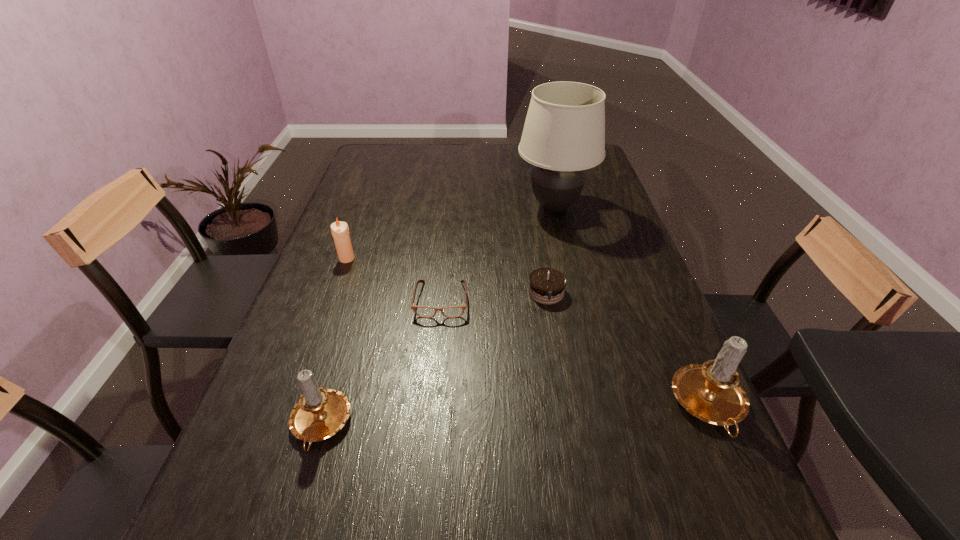
You are a GUI agent. You are given a task and a screenshot of the screen. Output one action in this format:
    pyautogui.click(x=<x>, y=<y>)
    Task: Click on the vacant space located on the front of the chocolate cake
    
    Given the screenshot: What is the action you would take?
    pyautogui.click(x=571, y=444)

Where is `free point located on the back of the fifth nearest object`? free point located on the back of the fifth nearest object is located at coordinates point(367,205).

At what (x,y) coordinates should I click in order to perform the action: click on vacant area situated 0.090m on the front-facing side of the shortest object. Please return your answer as a coordinate pair (x, y). The height and width of the screenshot is (540, 960). Looking at the image, I should click on (437, 349).

Find the location of a particular element. candle that is at the right edge is located at coordinates (711, 392).

You are a GUI agent. You are given a task and a screenshot of the screen. Output one action in this format:
    pyautogui.click(x=<x>, y=<y>)
    Task: Click on the lampshade that is at the right edge
    
    Given the screenshot: What is the action you would take?
    pyautogui.click(x=564, y=132)

You are a GUI agent. You are given a task and a screenshot of the screen. Output one action in this format:
    pyautogui.click(x=<x>, y=<y>)
    Task: Click on the object present at the near left corner
    
    Given the screenshot: What is the action you would take?
    pyautogui.click(x=320, y=413)

Image resolution: width=960 pixels, height=540 pixels. In order to click on object that is at the near right corner in this screenshot , I will do `click(711, 392)`.

Locate an element on the screen. free region at the far edge of the desktop is located at coordinates (513, 145).

Where is `vacant space at the near edge of the desktop`? vacant space at the near edge of the desktop is located at coordinates (422, 466).

Image resolution: width=960 pixels, height=540 pixels. I want to click on free region at the left edge of the desktop, so click(x=326, y=278).